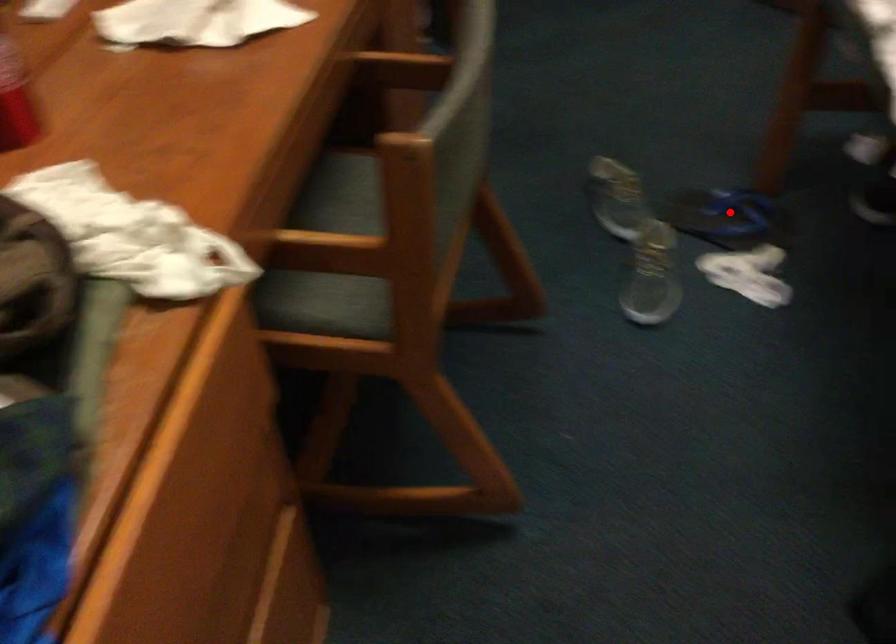
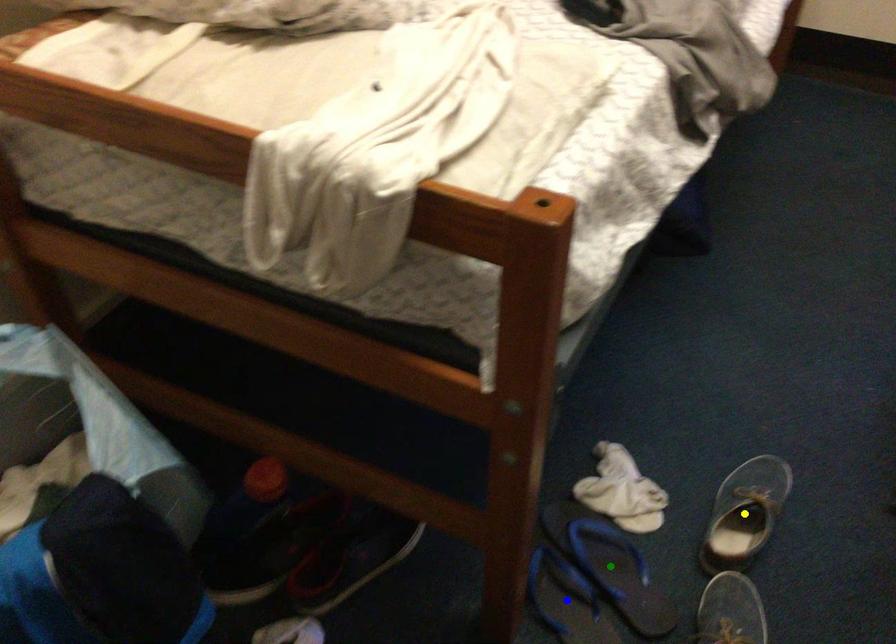
Question: I am providing you with two images of the same scene from different viewpoints. A red point is marked on the first image. You are given multiple points on the second image. Which mark in image 2 goes with the point in image 1?

Choices:
 (A) green point
 (B) yellow point
 (C) blue point

Answer: (C)